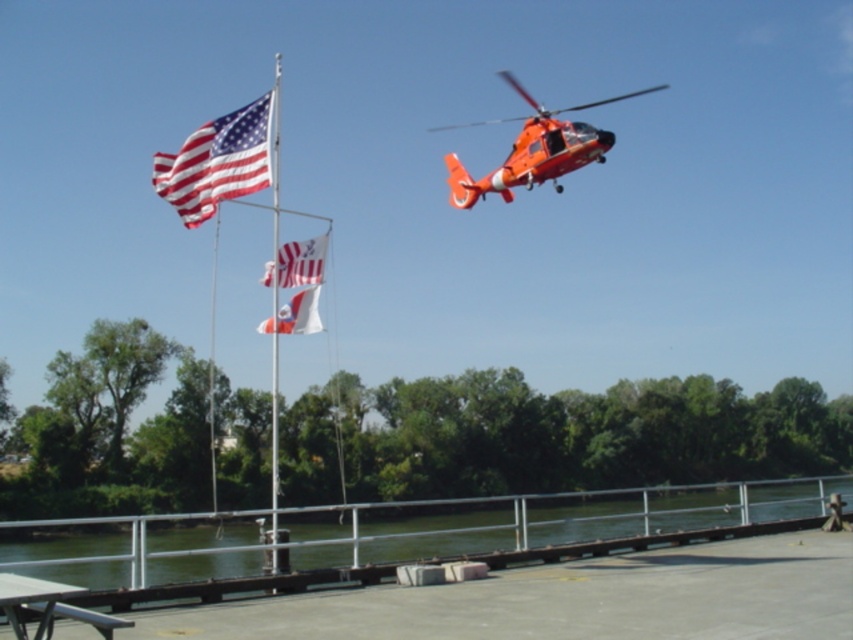
Question: Which point appears farthest from the camera in this image?

Choices:
 (A) (271, 467)
 (B) (390, 611)
 (C) (39, 596)
 (D) (463, 204)

Answer: (A)

Question: Which object is farther from the camera taking this photo?

Choices:
 (A) white fabric flag at upper center
 (B) orange matte helicopter at upper center

Answer: (B)

Question: Based on their relative distances, which object is farther from the white fabric flag at upper center?

Choices:
 (A) metallic flag pole at center
 (B) orange matte helicopter at upper center
 (C) american flag at upper left
 (D) concrete at center

Answer: (B)

Question: Is american flag at upper left wider than metallic silver picnic table at lower left?

Choices:
 (A) no
 (B) yes

Answer: (A)

Question: Can you confirm if concrete at center is positioned below metallic silver picnic table at lower left?

Choices:
 (A) yes
 (B) no

Answer: (B)

Question: Is american flag at upper left to the left of orange matte helicopter at upper center from the viewer's perspective?

Choices:
 (A) yes
 (B) no

Answer: (A)